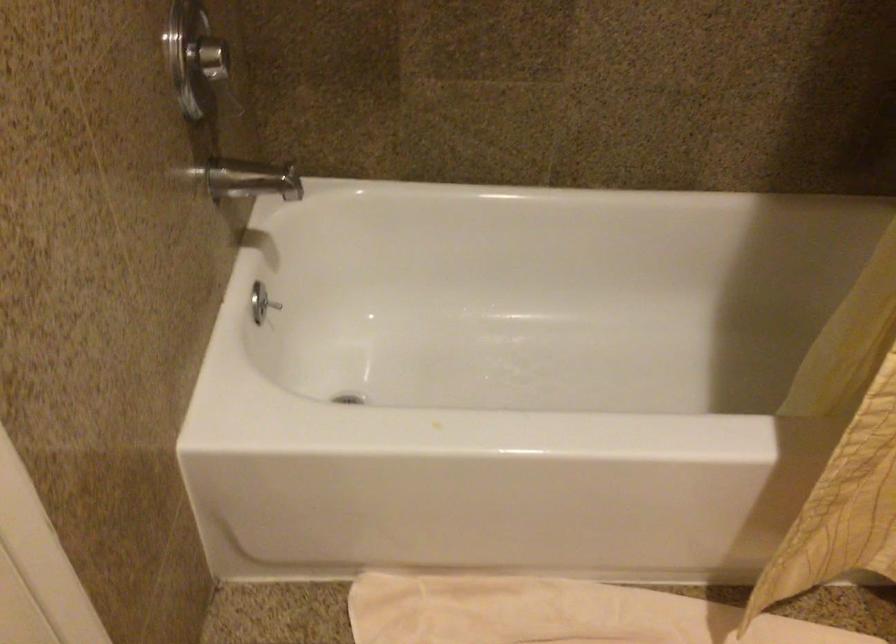
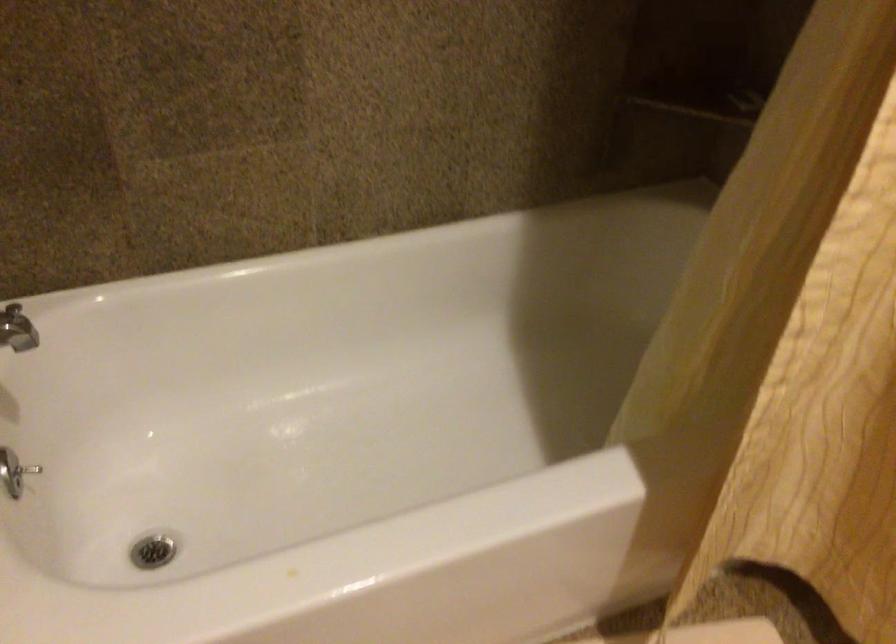
What movement of the cameraman would produce the second image?

The cameraman walked toward left, forward.